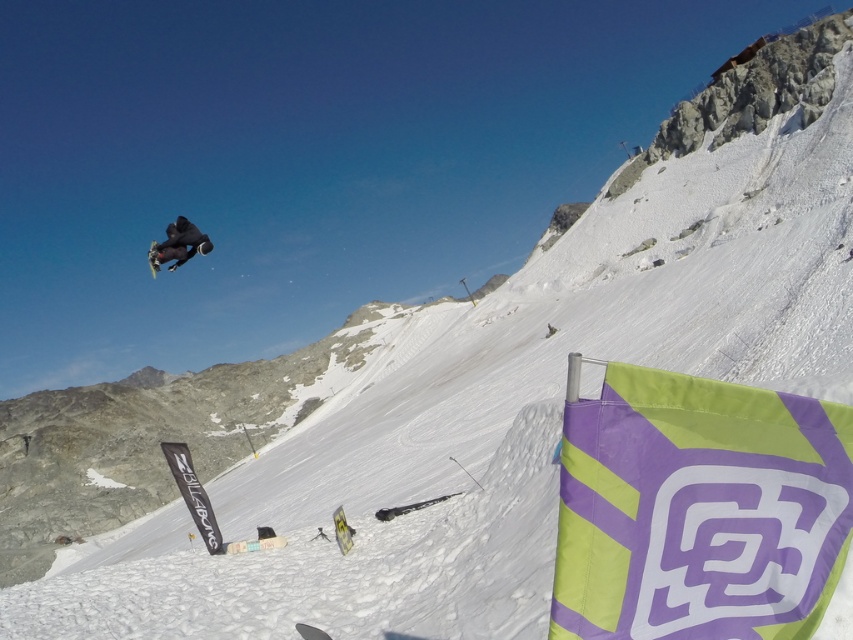
You are a photographer trying to capture the best shot of the black matte snowboarder at upper center and the shiny black snowboard at upper left. Which object should you focus on if you want to highlight something that takes up more visual space in the photo?

The shiny black snowboard at upper left should be focused on because it occupies more visual space than the black matte snowboarder at upper center.

You are a photographer at the snowboarding event. You want to capture a photo of the black matte snowboarder at upper center and the shiny black snowboard at upper left. Which object is closer to the camera?

The black matte snowboarder at upper center is positioned under the shiny black snowboard at upper left, so the snowboarder is closer to the camera than the snowboard.

You are a photographer trying to capture the black matte snowboarder at upper center and the shiny black snowboard at upper left in a single shot. Which object will appear smaller in the photo?

The black matte snowboarder at upper center will appear smaller because it is thinner than the shiny black snowboard at upper left.